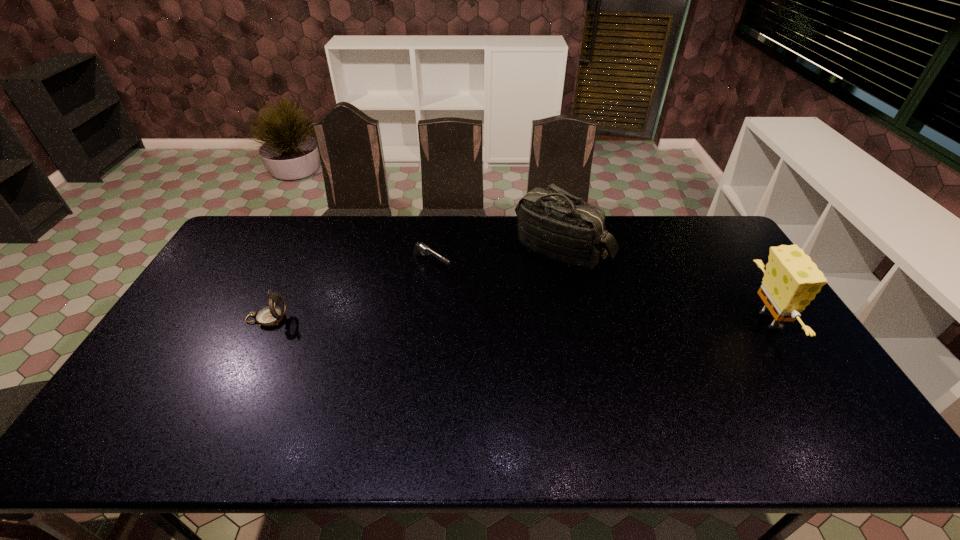
Locate an element on the screen. The image size is (960, 540). vacant area situated 0.280m at the front padded panel of the third object from left to right is located at coordinates (525, 338).

The height and width of the screenshot is (540, 960). I want to click on free space located at the front padded panel of the third object from left to right, so click(x=540, y=299).

At what (x,y) coordinates should I click in order to perform the action: click on vacant space located 0.110m at the front padded panel of the third object from left to right. Please return your answer as a coordinate pair (x, y). Image resolution: width=960 pixels, height=540 pixels. Looking at the image, I should click on (540, 299).

Find the location of `pistol located in the far edge section of the desktop`. pistol located in the far edge section of the desktop is located at coordinates (419, 248).

This screenshot has height=540, width=960. Identify the location of shoulder bag that is at the far edge. (552, 223).

I want to click on object located in the right edge section of the desktop, so click(791, 280).

Locate an element on the screen. free space at the far edge of the desktop is located at coordinates (616, 215).

You are a GUI agent. You are given a task and a screenshot of the screen. Output one action in this format:
    pyautogui.click(x=<x>, y=<y>)
    Task: Click on the free point at the near edge
    Image resolution: width=960 pixels, height=540 pixels.
    Given the screenshot: What is the action you would take?
    pyautogui.click(x=660, y=396)

This screenshot has width=960, height=540. In order to click on free space at the left edge of the desktop in this screenshot , I will do `click(232, 278)`.

The width and height of the screenshot is (960, 540). Find the location of `vacant space at the right edge of the desktop`. vacant space at the right edge of the desktop is located at coordinates (718, 295).